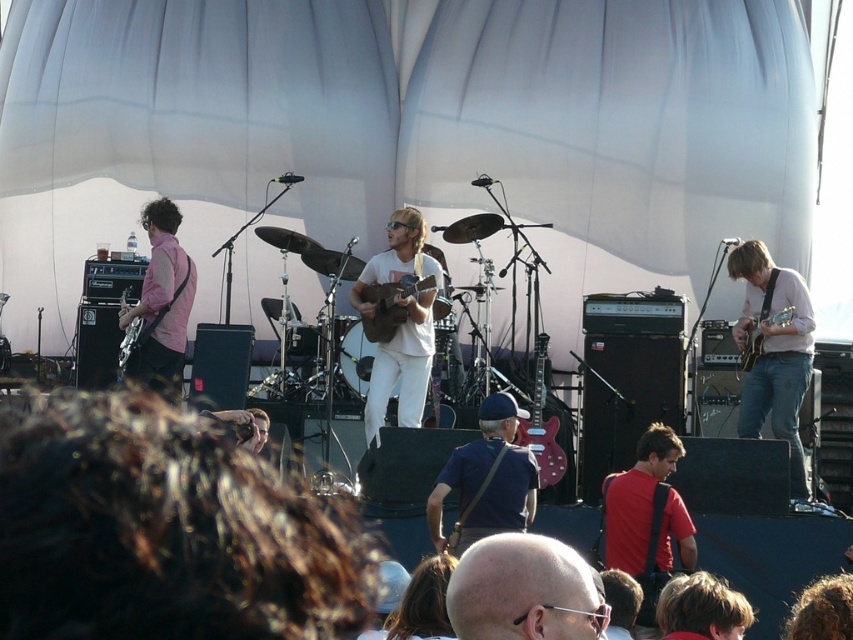
Measure the distance between point [373,340] and camera.

Point [373,340] and camera are 76.07 meters apart from each other.

Between point (396, 305) and point (136, 324), which one is positioned in front?

Point (396, 305) is in front.

This screenshot has width=853, height=640. What do you see at coordinates (390, 305) in the screenshot?
I see `matte brown guitar at center` at bounding box center [390, 305].

Locate an element on the screen. This screenshot has height=640, width=853. matte brown guitar at center is located at coordinates (390, 305).

Is pink matte shirt at center positioned before pink matte shirt at left?

Yes, pink matte shirt at center is closer to the viewer.

Does pink matte shirt at center appear under pink matte shirt at left?

Yes.

Find the location of a particular element. pink matte shirt at center is located at coordinates (773, 352).

Identify the location of pink matte shirt at center. (773, 352).

This screenshot has width=853, height=640. I want to click on pink matte shirt at center, so click(773, 352).

Who is positioned more to the right, pink matte shirt at center or matte brown guitar at center?

pink matte shirt at center is more to the right.

Is point (776, 269) positioned before point (381, 321)?

That is True.

Image resolution: width=853 pixels, height=640 pixels. Identify the location of pink matte shirt at center. (773, 352).